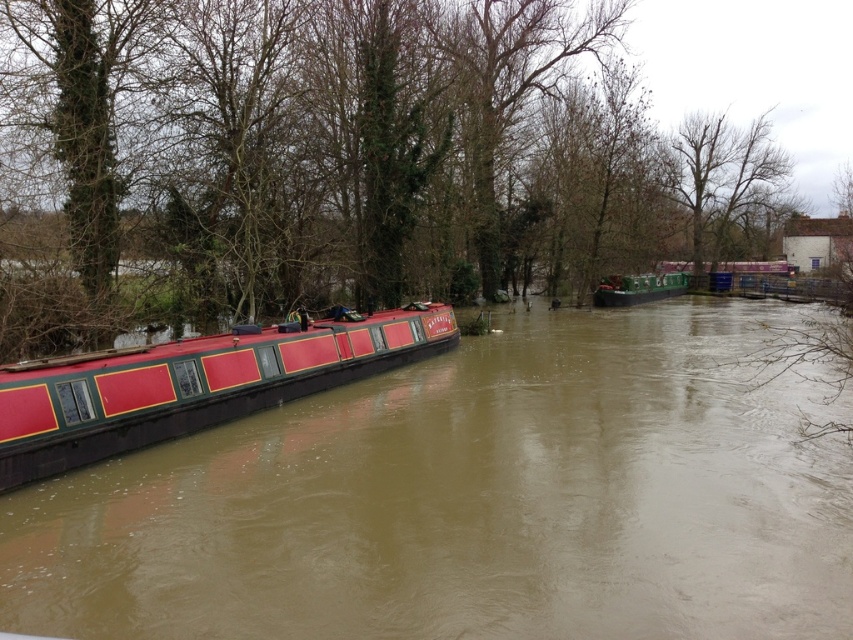
Who is more distant from viewer, (202, 371) or (672, 285)?

Point (672, 285)

Measure the distance between point (274, 371) and camera.

Point (274, 371) and camera are 12.92 meters apart from each other.

Identify the location of matte red barge at left. The image size is (853, 640). (192, 385).

Looking at this image, is bare branches at upper center above green matte barge at center?

Yes.

Which is behind, point (692, 189) or point (672, 284)?

The point (692, 189) is more distant.

Locate an element on the screen. The image size is (853, 640). bare branches at upper center is located at coordinates (722, 179).

Can you confirm if matte red boat at left is positioned to the left of matte red barge at left?

No, matte red boat at left is not to the left of matte red barge at left.

Measure the distance between matte red boat at left and matte red barge at left.

The distance of matte red boat at left from matte red barge at left is 2.82 meters.

Locate an element on the screen. matte red boat at left is located at coordinates (471, 500).

The image size is (853, 640). I want to click on matte red boat at left, so click(x=471, y=500).